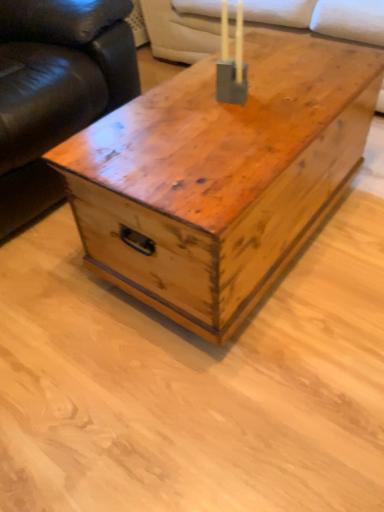
I want to click on blank space to the left of matte gray concrete candle holder at center, so click(x=178, y=104).